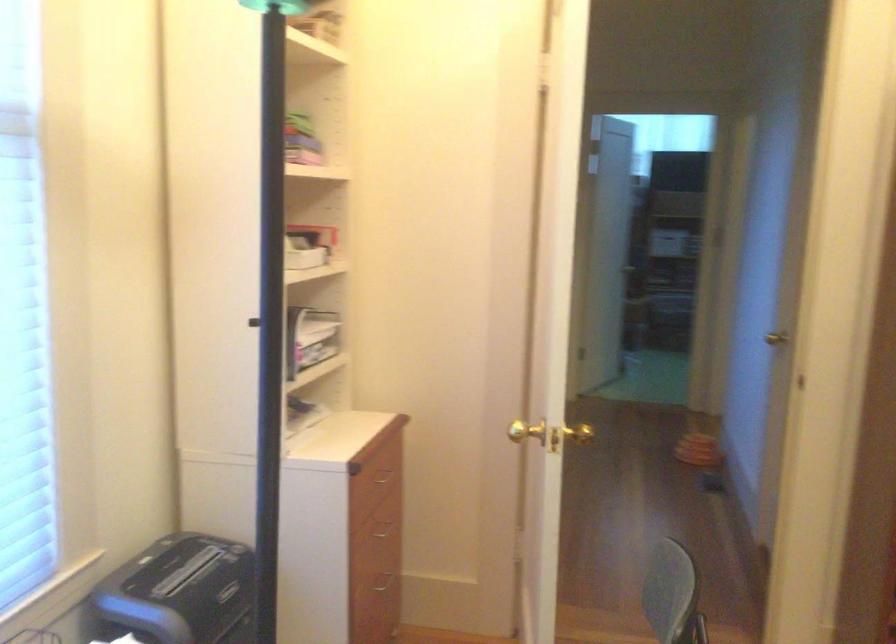
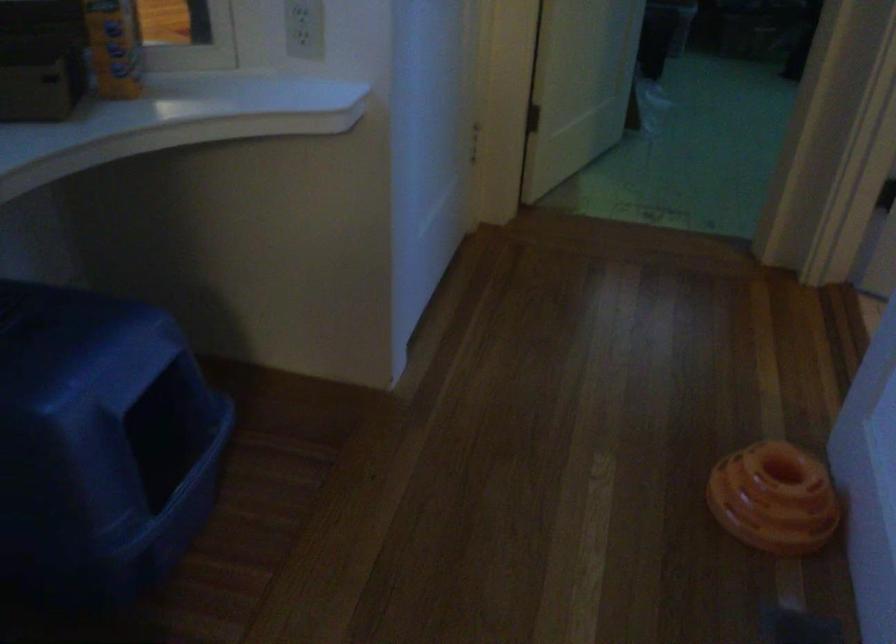
Question: The images are taken continuously from a first-person perspective. In which direction are you moving?

Choices:
 (A) Left
 (B) Right
 (C) Forward
 (D) Backward

Answer: (C)